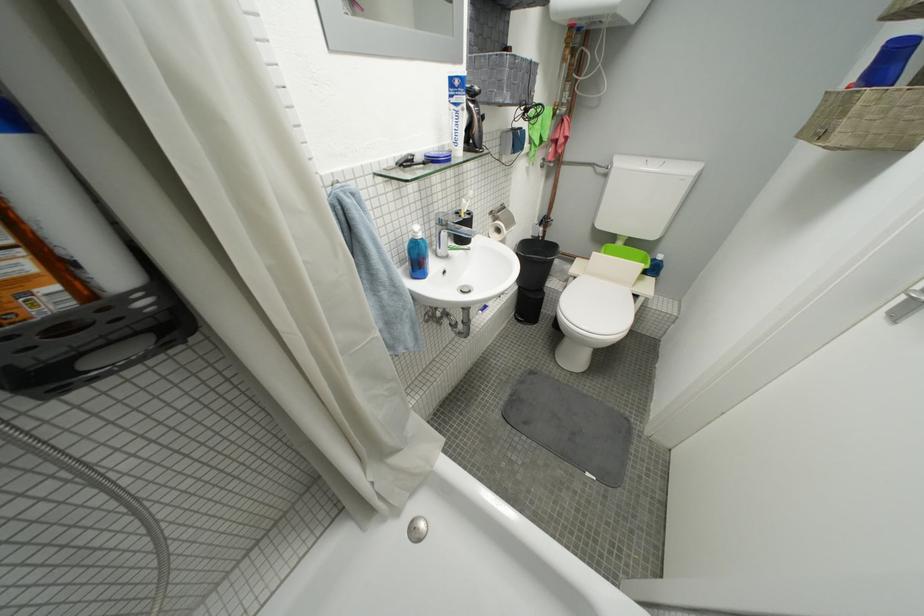
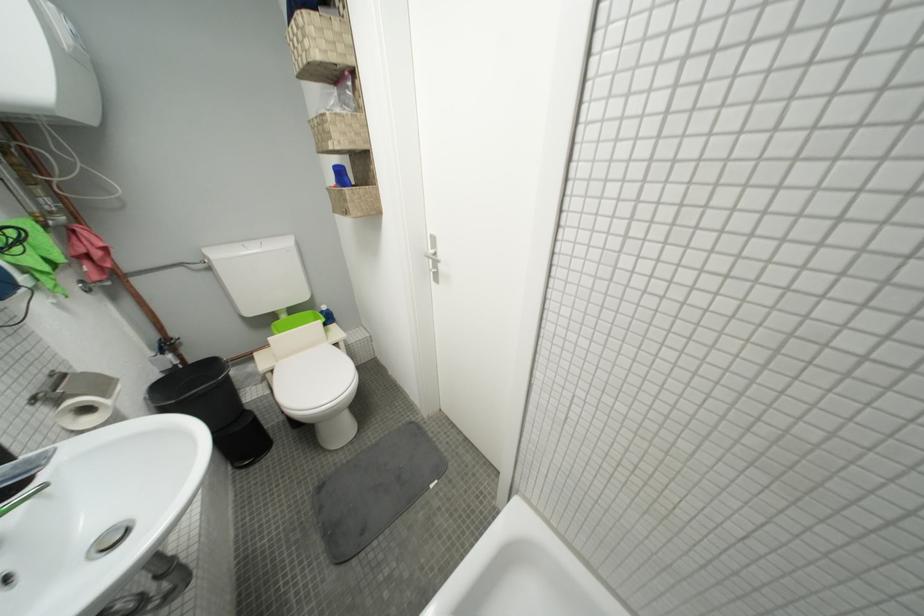
The point at (516, 229) is marked in the first image. Where is the corresponding point in the second image?

(113, 397)